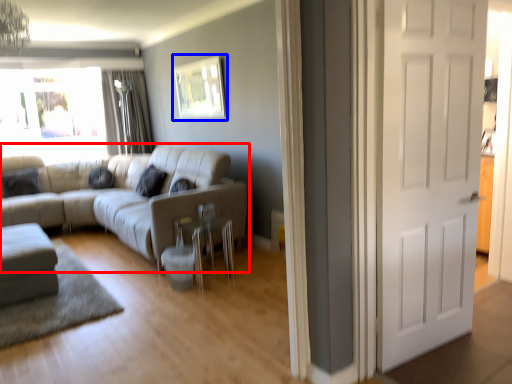
Question: Which object appears closest to the camera in this image, studio couch (highlighted by a red box) or picture frame (highlighted by a blue box)?

Choices:
 (A) studio couch
 (B) picture frame

Answer: (A)